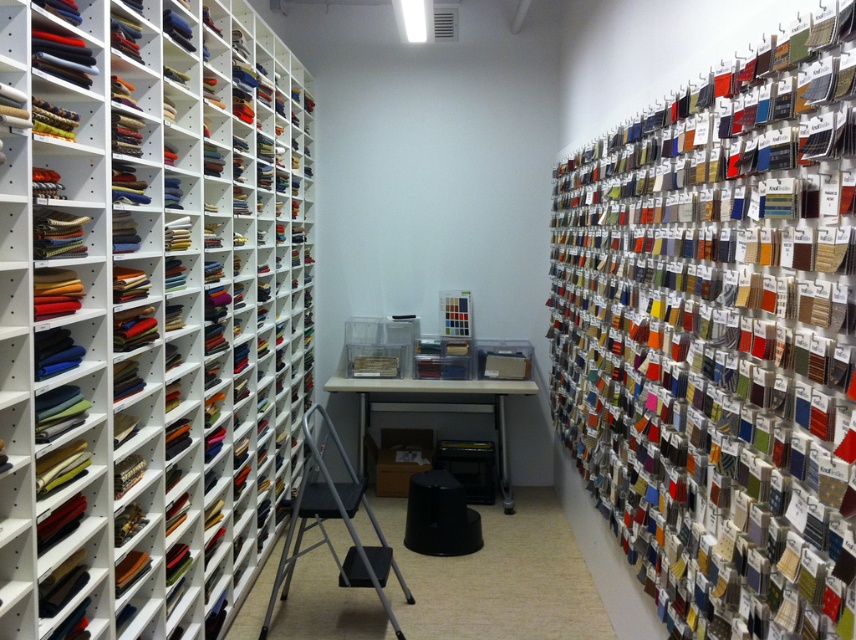
Question: Based on their relative distances, which object is farther from the matte plastic bookshelf at right?

Choices:
 (A) black plastic stool at center
 (B) matte fabric bookshelf at left

Answer: (B)

Question: From the image, what is the correct spatial relationship of matte fabric bookshelf at left in relation to black plastic stool at center?

Choices:
 (A) above
 (B) below

Answer: (A)

Question: Where is matte fabric bookshelf at left located in relation to black plastic stool at center in the image?

Choices:
 (A) left
 (B) right

Answer: (A)

Question: From the image, what is the correct spatial relationship of matte plastic bookshelf at right in relation to black plastic stool at center?

Choices:
 (A) left
 (B) right

Answer: (B)

Question: Which of these objects is positioned closest to the matte plastic bookshelf at right?

Choices:
 (A) black plastic stool at center
 (B) matte fabric bookshelf at left

Answer: (A)

Question: Which point is closer to the camera?

Choices:
 (A) (658, 452)
 (B) (421, 483)
 (C) (268, 122)

Answer: (A)